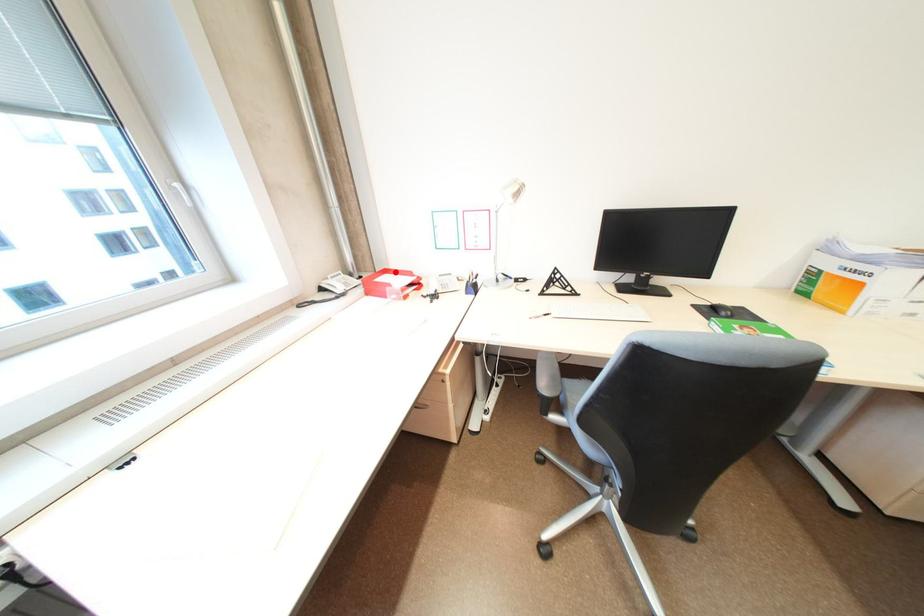
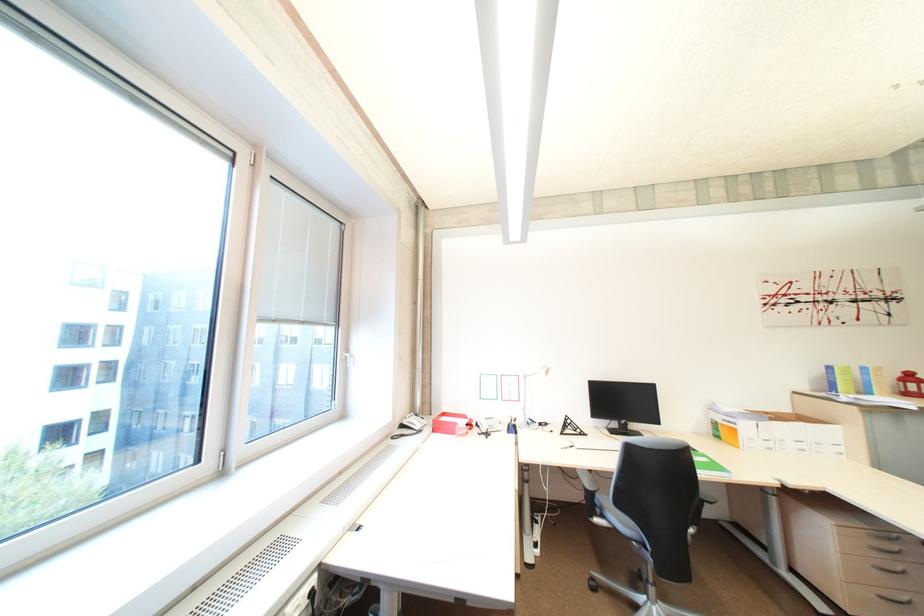
The point at the highlighted location is marked in the first image. Where is the corresponding point in the second image?

(454, 415)